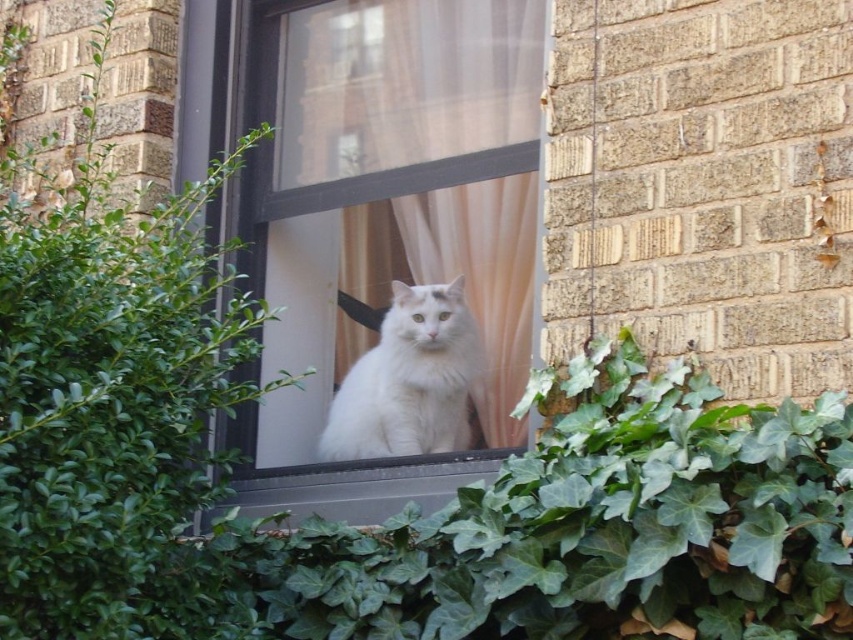
Question: Does clear glass window at center appear over green leafy bush at center?

Choices:
 (A) no
 (B) yes

Answer: (B)

Question: From the image, what is the correct spatial relationship of green leafy bush at center in relation to white fluffy cat at center?

Choices:
 (A) below
 (B) above

Answer: (B)

Question: Which object appears closest to the camera in this image?

Choices:
 (A) white fluffy cat at center
 (B) green leafy bush at center

Answer: (B)

Question: Which point is farther to the camera?

Choices:
 (A) (97, 417)
 (B) (502, 26)

Answer: (B)

Question: Which of the following is the farthest from the observer?

Choices:
 (A) (x=357, y=403)
 (B) (x=271, y=397)

Answer: (B)

Question: Can you confirm if green leafy bush at center is smaller than white fluffy cat at center?

Choices:
 (A) yes
 (B) no

Answer: (B)